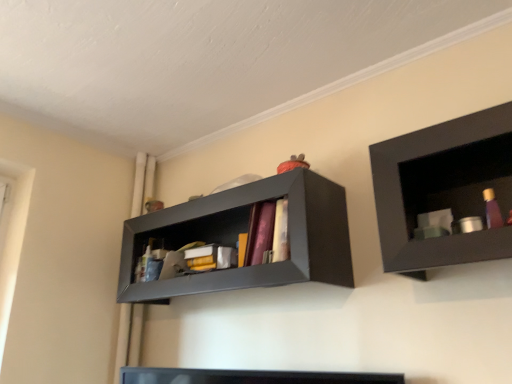
Question: Can you confirm if matte black shelf at upper center, which ranks as the 2th shelf in right-to-left order, is smaller than matte black shelf at upper right, marked as the first shelf in a right-to-left arrangement?

Choices:
 (A) no
 (B) yes

Answer: (A)

Question: From the image's perspective, is matte black shelf at upper center, which is the second shelf from front to back, located beneath matte black shelf at upper right, the 2th shelf in the left-to-right sequence?

Choices:
 (A) yes
 (B) no

Answer: (A)

Question: From the image's perspective, is matte black shelf at upper center, which is the 1th shelf in left-to-right order, over matte black shelf at upper right, marked as the first shelf in a right-to-left arrangement?

Choices:
 (A) no
 (B) yes

Answer: (A)

Question: Does matte black shelf at upper center, which ranks as the 2th shelf in right-to-left order, have a greater width compared to matte black shelf at upper right, marked as the 1th shelf in a front-to-back arrangement?

Choices:
 (A) yes
 (B) no

Answer: (A)

Question: From a real-world perspective, is matte black shelf at upper center, which is the 1th shelf in left-to-right order, over matte black shelf at upper right, the 2th shelf in the left-to-right sequence?

Choices:
 (A) no
 (B) yes

Answer: (B)

Question: From a real-world perspective, is matte black shelf at upper center, which is the 1th shelf in left-to-right order, beneath matte black shelf at upper right, marked as the first shelf in a right-to-left arrangement?

Choices:
 (A) yes
 (B) no

Answer: (B)

Question: Can you confirm if matte black shelf at upper right, marked as the first shelf in a right-to-left arrangement, is positioned to the right of matte black shelf at upper center, which is the second shelf from front to back?

Choices:
 (A) no
 (B) yes

Answer: (B)

Question: From the image's perspective, is matte black shelf at upper right, the 2th shelf in the left-to-right sequence, located above matte black shelf at upper center, which is the 1th shelf in left-to-right order?

Choices:
 (A) yes
 (B) no

Answer: (A)

Question: Does matte black shelf at upper right, marked as the 1th shelf in a front-to-back arrangement, lie behind matte black shelf at upper center, which ranks as the 2th shelf in right-to-left order?

Choices:
 (A) no
 (B) yes

Answer: (A)

Question: Is matte black shelf at upper right, which is the second shelf from back to front, in front of matte black shelf at upper center, which is the second shelf from front to back?

Choices:
 (A) yes
 (B) no

Answer: (A)

Question: From a real-world perspective, is matte black shelf at upper right, marked as the first shelf in a right-to-left arrangement, beneath matte black shelf at upper center, which is the second shelf from front to back?

Choices:
 (A) no
 (B) yes

Answer: (B)

Question: Are matte black shelf at upper right, marked as the 1th shelf in a front-to-back arrangement, and matte black shelf at upper center, the first shelf from the back, far apart?

Choices:
 (A) no
 (B) yes

Answer: (A)

Question: From the image's perspective, is matte black shelf at upper center, the first shelf from the back, positioned above or below matte black shelf at upper right, marked as the 1th shelf in a front-to-back arrangement?

Choices:
 (A) below
 (B) above

Answer: (A)